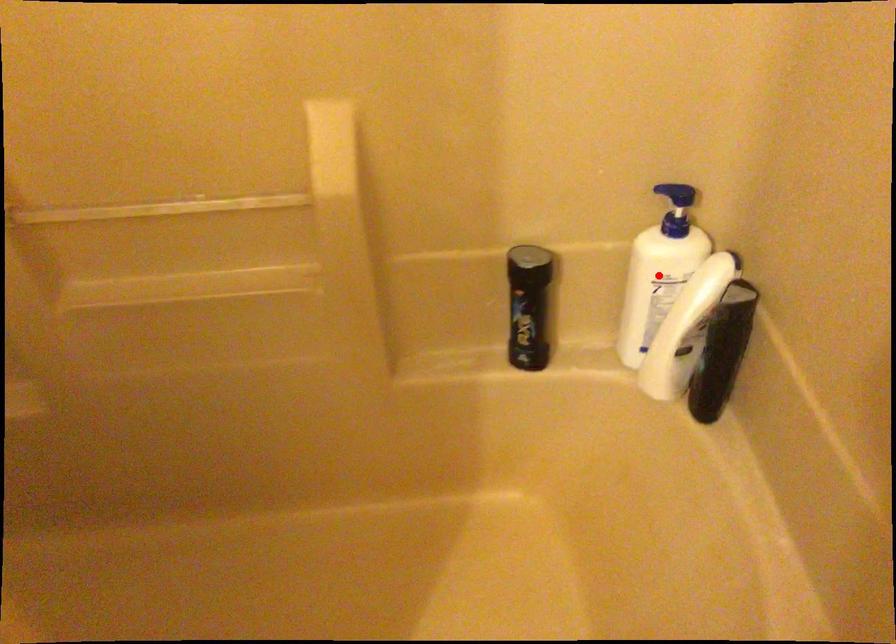
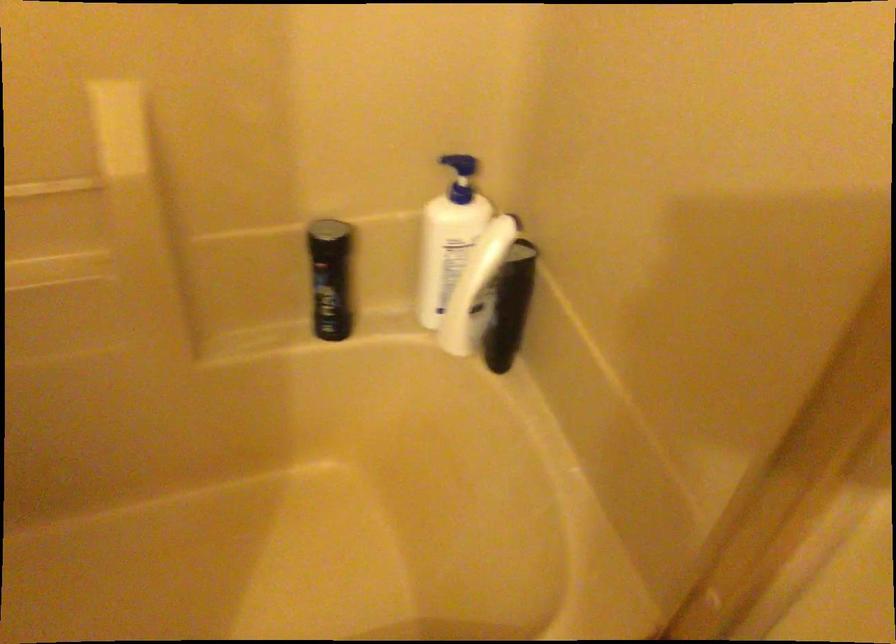
In the second image, find the point that corresponds to the highlighted location in the first image.

(451, 242)